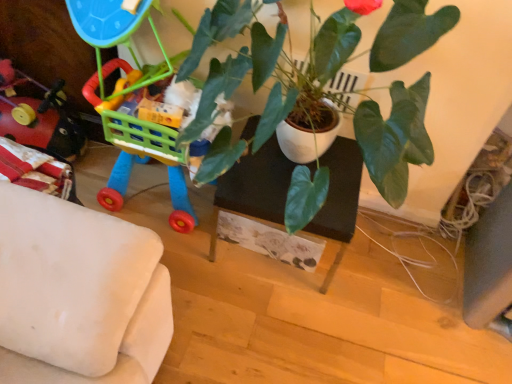
Question: From a real-world perspective, is plastic toy cart at left, which is the second toy in left-to-right order, physically below rubberized plastic toy at left, which appears as the first toy when viewed from the left?

Choices:
 (A) no
 (B) yes

Answer: (A)

Question: From the image's perspective, is plastic toy cart at left, which is the second toy in left-to-right order, located above rubberized plastic toy at left, the second toy viewed from the right?

Choices:
 (A) no
 (B) yes

Answer: (B)

Question: Is plastic toy cart at left, the 1th toy from the right, shorter than rubberized plastic toy at left, the second toy viewed from the right?

Choices:
 (A) yes
 (B) no

Answer: (B)

Question: Considering the relative positions of plastic toy cart at left, which is the second toy in left-to-right order, and rubberized plastic toy at left, which appears as the first toy when viewed from the left, in the image provided, is plastic toy cart at left, which is the second toy in left-to-right order, to the left of rubberized plastic toy at left, which appears as the first toy when viewed from the left, from the viewer's perspective?

Choices:
 (A) no
 (B) yes

Answer: (A)

Question: Is plastic toy cart at left, the 1th toy from the right, smaller than rubberized plastic toy at left, which appears as the first toy when viewed from the left?

Choices:
 (A) no
 (B) yes

Answer: (A)

Question: Are plastic toy cart at left, which is the second toy in left-to-right order, and rubberized plastic toy at left, which appears as the first toy when viewed from the left, far apart?

Choices:
 (A) yes
 (B) no

Answer: (B)

Question: From a real-world perspective, is rubberized plastic toy at left, the second toy viewed from the right, positioned under green glossy plant at center based on gravity?

Choices:
 (A) yes
 (B) no

Answer: (A)

Question: Is rubberized plastic toy at left, which appears as the first toy when viewed from the left, positioned with its back to green glossy plant at center?

Choices:
 (A) yes
 (B) no

Answer: (B)

Question: Does rubberized plastic toy at left, the second toy viewed from the right, have a smaller size compared to green glossy plant at center?

Choices:
 (A) yes
 (B) no

Answer: (A)

Question: Is rubberized plastic toy at left, the second toy viewed from the right, aimed at green glossy plant at center?

Choices:
 (A) no
 (B) yes

Answer: (A)

Question: Is rubberized plastic toy at left, the second toy viewed from the right, further to camera compared to green glossy plant at center?

Choices:
 (A) yes
 (B) no

Answer: (A)

Question: Is rubberized plastic toy at left, the second toy viewed from the right, to the right of green glossy plant at center from the viewer's perspective?

Choices:
 (A) yes
 (B) no

Answer: (B)

Question: Is the position of black matte table at center more distant than that of green glossy plant at center?

Choices:
 (A) yes
 (B) no

Answer: (A)